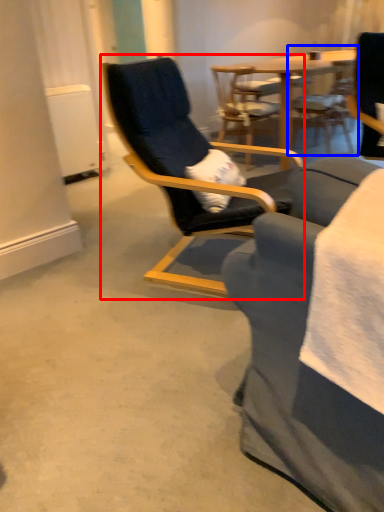
Question: Which object is further to the camera taking this photo, chair (highlighted by a red box) or chair (highlighted by a blue box)?

Choices:
 (A) chair
 (B) chair

Answer: (B)